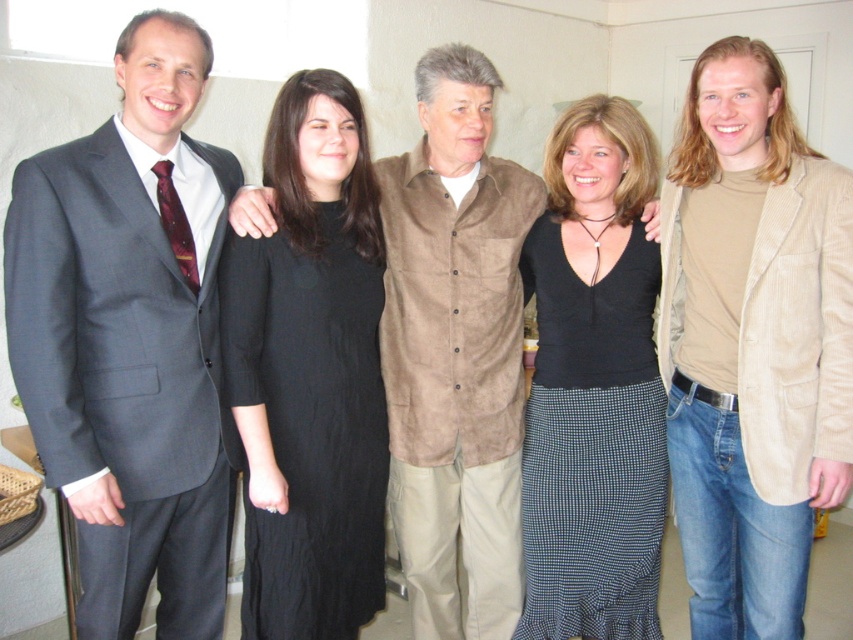
Question: Which point appears farthest from the camera in this image?

Choices:
 (A) click(519, 412)
 (B) click(546, 346)
 (C) click(708, 228)

Answer: (A)

Question: Which is farther from the matte gray suit at left?

Choices:
 (A) suede shirt at center
 (B) black dress at center

Answer: (B)

Question: Among these objects, which one is farthest from the camera?

Choices:
 (A) matte gray suit at left
 (B) black cotton dress at center

Answer: (B)

Question: Does black cotton dress at center appear on the left side of black jersey at center?

Choices:
 (A) no
 (B) yes

Answer: (B)

Question: Is black cotton dress at center smaller than suede shirt at center?

Choices:
 (A) no
 (B) yes

Answer: (B)

Question: Can you confirm if black cotton dress at center is positioned to the right of black jersey at center?

Choices:
 (A) no
 (B) yes

Answer: (A)